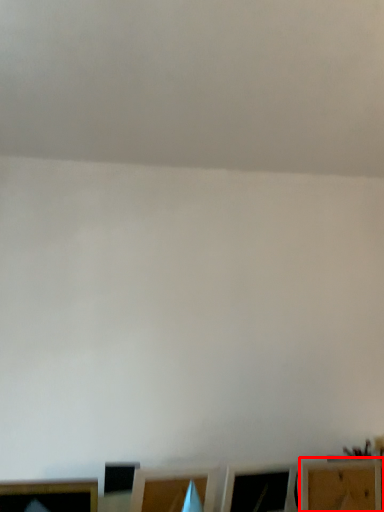
Question: Considering the relative positions of furniture (annotated by the red box) and furniture in the image provided, where is furniture (annotated by the red box) located with respect to the staircase?

Choices:
 (A) right
 (B) left

Answer: (A)